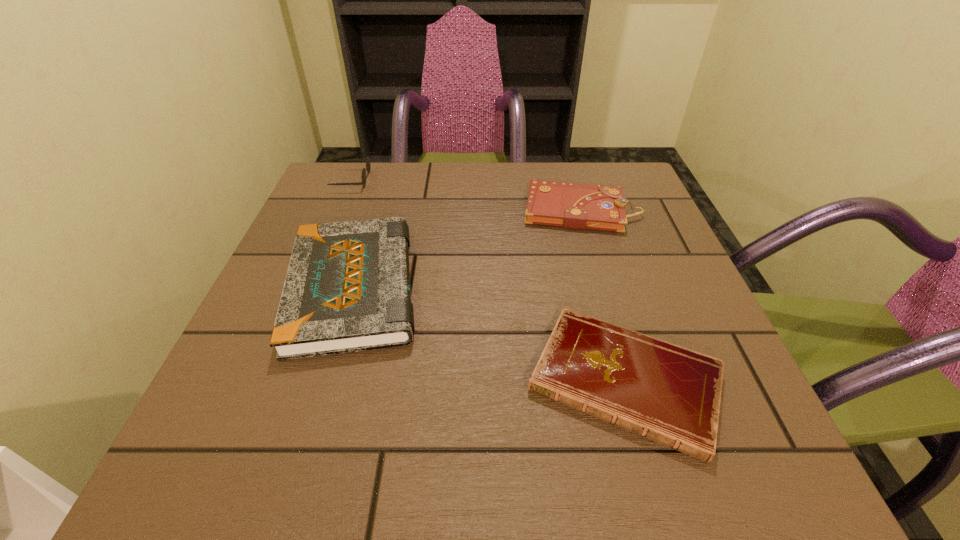
Where is `object that is at the near edge`? The image size is (960, 540). object that is at the near edge is located at coordinates (669, 394).

I want to click on sunglasses that is at the left edge, so click(368, 165).

This screenshot has height=540, width=960. What are the coordinates of `notebook that is at the left edge` in the screenshot? It's located at (347, 289).

This screenshot has height=540, width=960. I want to click on object positioned at the far left corner, so click(368, 165).

Locate an element on the screen. object present at the far right corner is located at coordinates (579, 206).

Identify the location of object present at the near right corner. Image resolution: width=960 pixels, height=540 pixels. (669, 394).

The height and width of the screenshot is (540, 960). Identify the location of free region at the far edge. (482, 163).

In order to click on vacant region at the near edge of the desktop in this screenshot , I will do `click(517, 457)`.

The width and height of the screenshot is (960, 540). In order to click on vacant space at the right edge of the desktop in this screenshot , I will do `click(612, 239)`.

In the image, there is a desktop. Where is `vacant space at the far left corner`? The image size is (960, 540). vacant space at the far left corner is located at coordinates (383, 178).